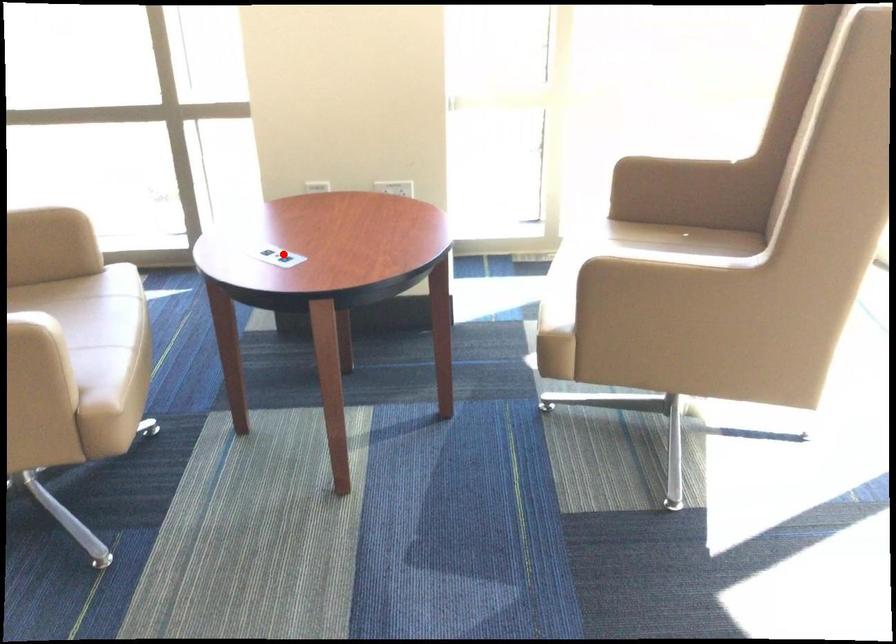
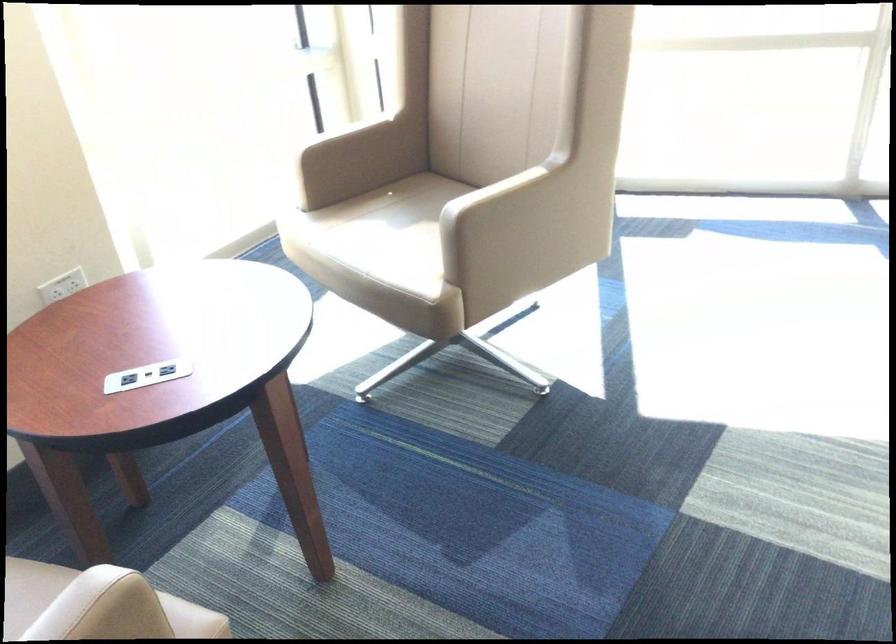
Question: I am providing you with two images of the same scene from different viewpoints. Given a red point in image1, look at the same physical point in image2. Is it:

Choices:
 (A) Closer to the viewpoint
 (B) Farther from the viewpoint

Answer: (A)